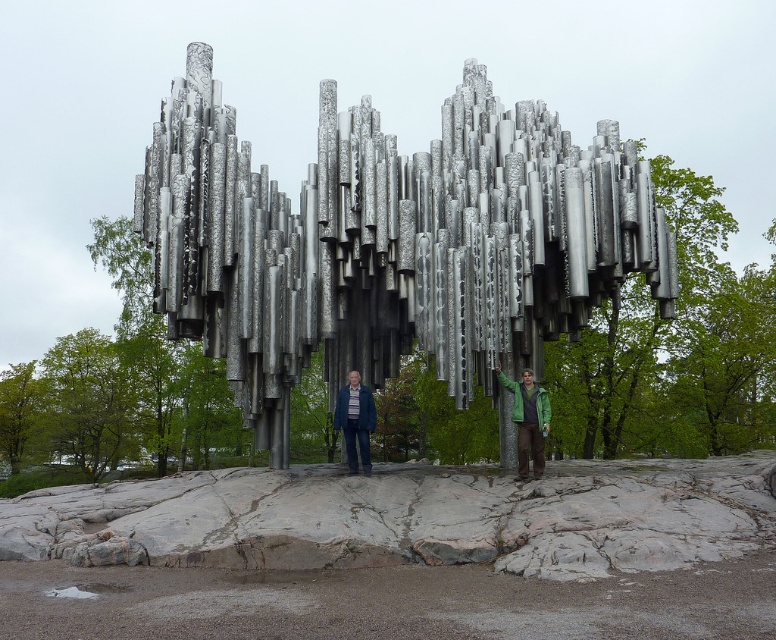
Between silver metallic wind chimes at center and metallic textured jackets at center, which one is positioned higher?

silver metallic wind chimes at center

Based on the photo, is silver metallic wind chimes at center to the right of metallic textured jackets at center from the viewer's perspective?

Incorrect, silver metallic wind chimes at center is not on the right side of metallic textured jackets at center.

This screenshot has height=640, width=776. In order to click on silver metallic wind chimes at center in this screenshot , I will do `click(390, 241)`.

Does silver metallic wind chimes at center appear on the left side of green matte jacket at center?

Yes, silver metallic wind chimes at center is to the left of green matte jacket at center.

Where is `silver metallic wind chimes at center`? The height and width of the screenshot is (640, 776). silver metallic wind chimes at center is located at coordinates (390, 241).

Can you confirm if metallic textured jackets at center is thinner than matte blue jacket at center?

No, metallic textured jackets at center is not thinner than matte blue jacket at center.

Does point (373, 458) come closer to viewer compared to point (338, 422)?

No, it is behind (338, 422).

Find the location of a particular element. The image size is (776, 640). metallic textured jackets at center is located at coordinates (431, 419).